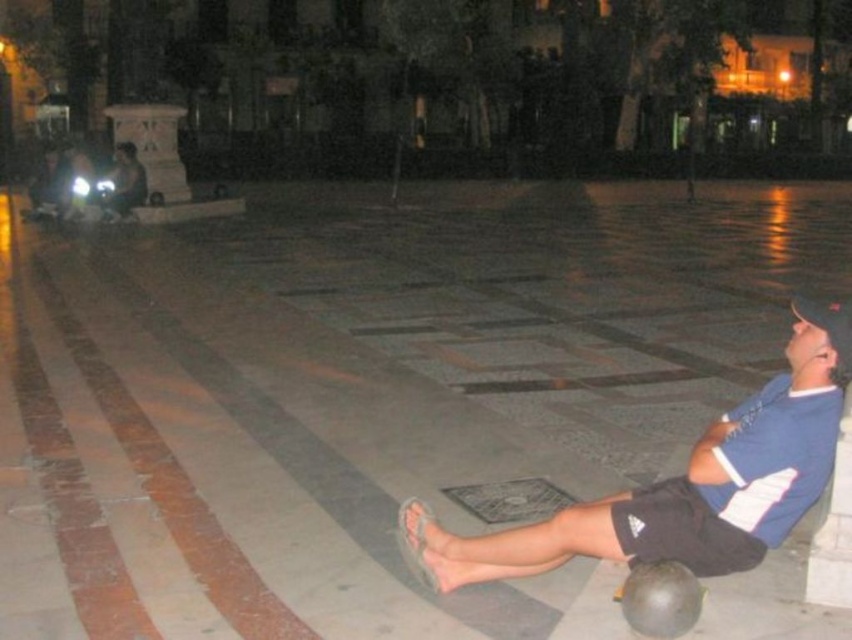
Question: Is gray concrete pavement at center above blue cotton shirt at center?

Choices:
 (A) yes
 (B) no

Answer: (A)

Question: Is gray concrete pavement at center bigger than blue cotton shirt at center?

Choices:
 (A) yes
 (B) no

Answer: (A)

Question: In this image, where is gray concrete pavement at center located relative to blue cotton shirt at center?

Choices:
 (A) above
 (B) below

Answer: (A)